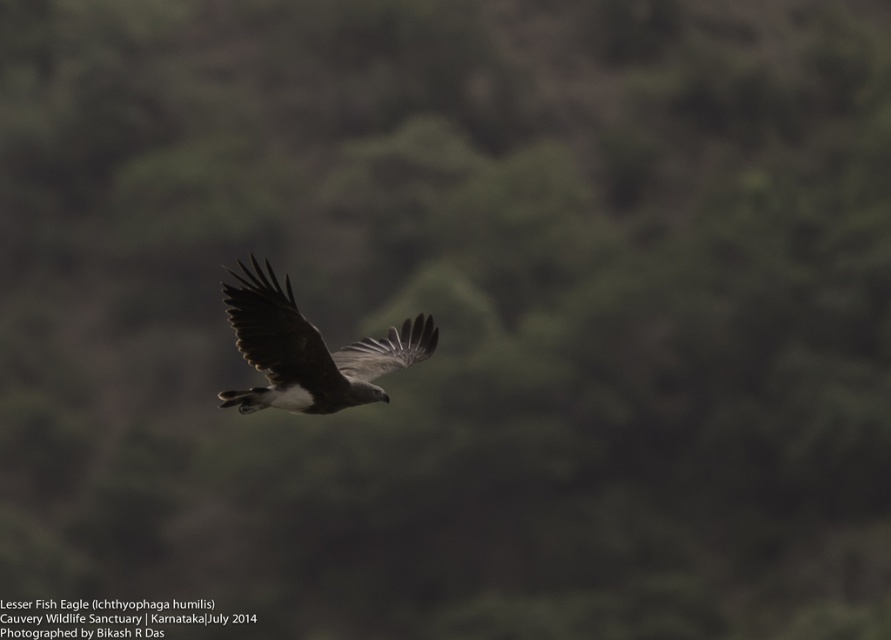
Is brown feathered eagle at center above dark brown feathered wing at center?

No, brown feathered eagle at center is not above dark brown feathered wing at center.

Between point (308, 337) and point (262, 288), which one is positioned behind?

Positioned behind is point (308, 337).

Identify the location of brown feathered eagle at center. (309, 352).

Can you confirm if dark brown feathered wing at center is positioned above dark gray feathered wing at center?

Yes, dark brown feathered wing at center is above dark gray feathered wing at center.

Between dark brown feathered wing at center and dark gray feathered wing at center, which one is positioned lower?

Positioned lower is dark gray feathered wing at center.

You are a GUI agent. You are given a task and a screenshot of the screen. Output one action in this format:
    pyautogui.click(x=<x>, y=<y>)
    Task: Click on the dark brown feathered wing at center
    This screenshot has height=640, width=891.
    Given the screenshot: What is the action you would take?
    pyautogui.click(x=278, y=333)

Is brown feathered eagle at center closer to camera compared to dark gray feathered wing at center?

That is True.

Is brown feathered eagle at center further to camera compared to dark gray feathered wing at center?

No, it is not.

The width and height of the screenshot is (891, 640). Describe the element at coordinates (309, 352) in the screenshot. I see `brown feathered eagle at center` at that location.

At what (x,y) coordinates should I click in order to perform the action: click on brown feathered eagle at center. Please return your answer as a coordinate pair (x, y). Looking at the image, I should click on (309, 352).